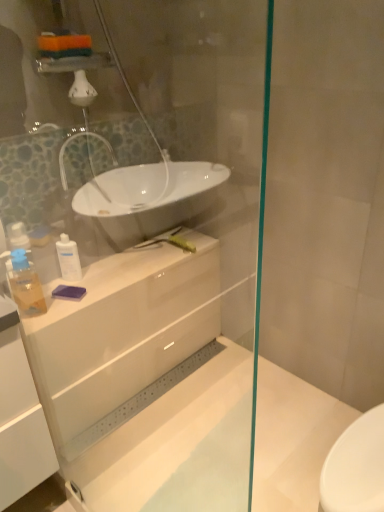
Question: Is white glossy lotion at center, the second toiletry in the left-to-right sequence, outside white glossy cabinet at center?

Choices:
 (A) yes
 (B) no

Answer: (A)

Question: Does white glossy lotion at center, the first toiletry in the back-to-front sequence, contain white glossy cabinet at center?

Choices:
 (A) no
 (B) yes

Answer: (A)

Question: Does white glossy lotion at center, which is the 1th toiletry in right-to-left order, lie behind white glossy cabinet at center?

Choices:
 (A) yes
 (B) no

Answer: (A)

Question: Could you tell me if white glossy lotion at center, the first toiletry in the back-to-front sequence, is facing white glossy cabinet at center?

Choices:
 (A) no
 (B) yes

Answer: (A)

Question: Can you confirm if white glossy lotion at center, the first toiletry in the back-to-front sequence, is thinner than white glossy cabinet at center?

Choices:
 (A) yes
 (B) no

Answer: (A)

Question: Considering the relative positions of white glossy cabinet at center and white glossy lotion at center, which is the 1th toiletry in right-to-left order, in the image provided, is white glossy cabinet at center to the left or to the right of white glossy lotion at center, which is the 1th toiletry in right-to-left order,?

Choices:
 (A) left
 (B) right

Answer: (B)

Question: Is white glossy cabinet at center inside or outside of white glossy lotion at center, the 2th toiletry positioned from the front?

Choices:
 (A) outside
 (B) inside

Answer: (A)

Question: From a real-world perspective, is white glossy cabinet at center positioned above or below white glossy lotion at center, the 2th toiletry positioned from the front?

Choices:
 (A) above
 (B) below

Answer: (B)

Question: Considering the positions of point (109, 352) and point (61, 232), is point (109, 352) closer or farther from the camera than point (61, 232)?

Choices:
 (A) closer
 (B) farther

Answer: (B)

Question: From the image's perspective, is translucent plastic soap dispenser at left, the 1th toiletry viewed from the front, located above or below white glossy lotion at center, which is the 1th toiletry in right-to-left order?

Choices:
 (A) below
 (B) above

Answer: (A)

Question: From a real-world perspective, is translucent plastic soap dispenser at left, marked as the 2th toiletry in a back-to-front arrangement, positioned above or below white glossy lotion at center, the 2th toiletry positioned from the front?

Choices:
 (A) below
 (B) above

Answer: (B)

Question: Considering the positions of translucent plastic soap dispenser at left, acting as the first toiletry starting from the left, and white glossy lotion at center, the 2th toiletry positioned from the front, in the image, is translucent plastic soap dispenser at left, acting as the first toiletry starting from the left, bigger or smaller than white glossy lotion at center, the 2th toiletry positioned from the front,?

Choices:
 (A) big
 (B) small

Answer: (A)

Question: Based on their positions, is translucent plastic soap dispenser at left, the 2th toiletry from the right, located to the left or right of white glossy lotion at center, the second toiletry in the left-to-right sequence?

Choices:
 (A) left
 (B) right

Answer: (A)

Question: Does point (99, 275) appear closer or farther from the camera than point (31, 266)?

Choices:
 (A) closer
 (B) farther

Answer: (A)

Question: From the image's perspective, relative to translucent plastic soap dispenser at left, the 1th toiletry viewed from the front, is white glossy cabinet at center above or below?

Choices:
 (A) above
 (B) below

Answer: (A)